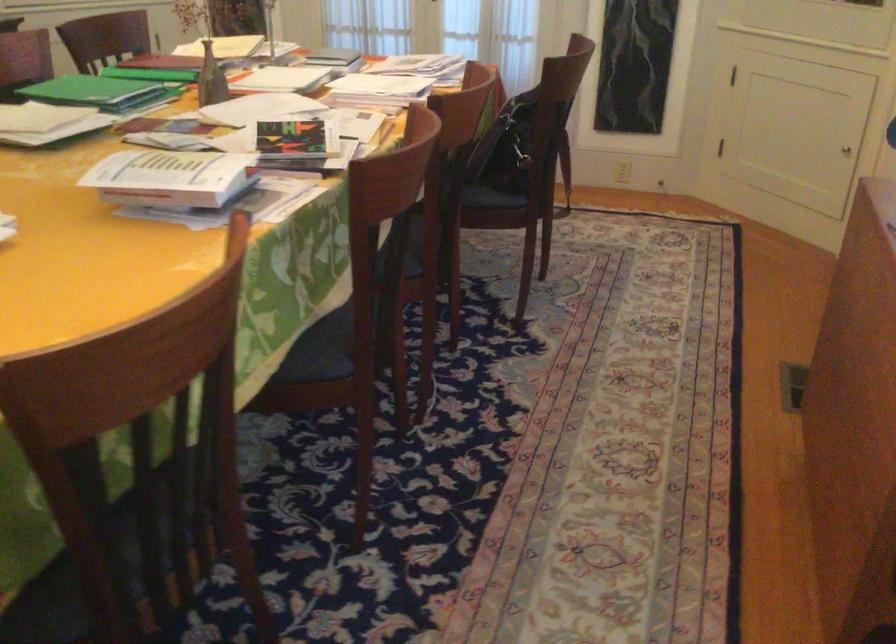
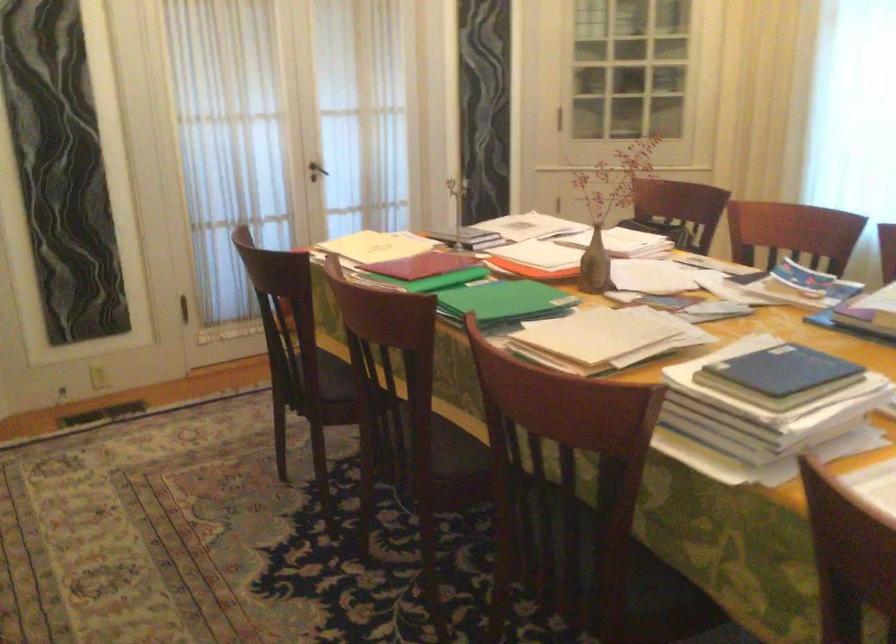
Question: I am providing you with two images of the same scene from different viewpoints. After the viewpoint changes to image2, which objects are now occluded?

Choices:
 (A) yellow lemon
 (B) chair sitting surface
 (C) cabinet door handle
 (D) yellow folder

Answer: (C)